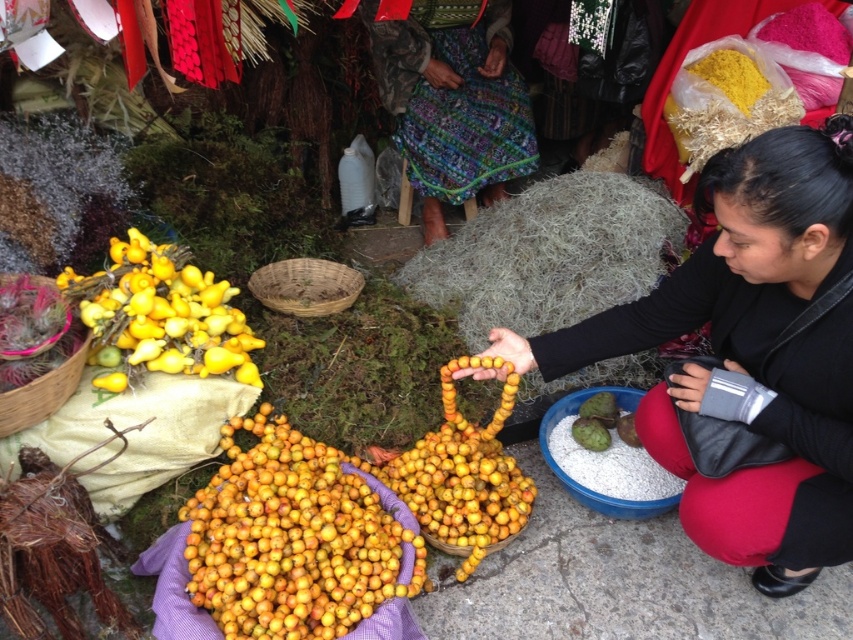
Question: Does black leather jacket at lower right appear on the left side of brown woven basket at left?

Choices:
 (A) yes
 (B) no

Answer: (B)

Question: Is yellow matte fruit at center wider than brown woven basket at left?

Choices:
 (A) yes
 (B) no

Answer: (A)

Question: Which of the following is the closest to the observer?

Choices:
 (A) woven brown basket at center
 (B) yellow matte fruit at left

Answer: (B)

Question: Is yellow matte fruit at center thinner than yellow matte fruit at left?

Choices:
 (A) no
 (B) yes

Answer: (A)

Question: Which point is farther to the camera?

Choices:
 (A) (341, 524)
 (B) (59, 400)

Answer: (B)

Question: Which object appears farthest from the camera in this image?

Choices:
 (A) yellow matte fruit at left
 (B) woven brown basket at center
 (C) brown woven basket at left
 (D) black leather jacket at lower right

Answer: (B)